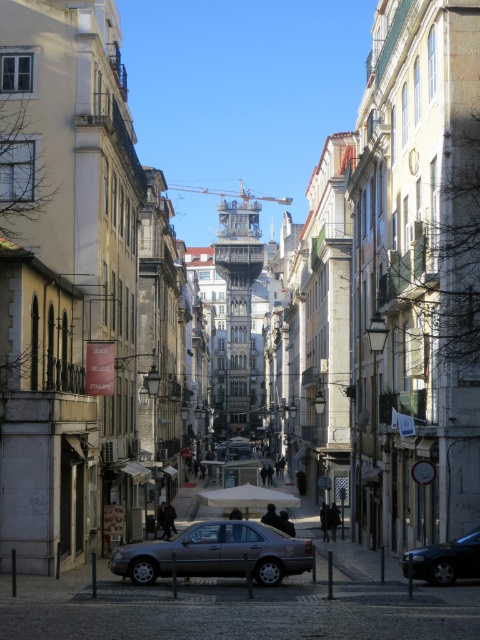
You are a delivery driver in Lisbon and need to park your metallic gray sedan at center. The parking spot is marked by a point at coordinates point (216,554). Can you safely park your car in this spot?

The point (216,554) indicates the location of the metallic gray sedan at center, so yes, you can safely park your metallic gray sedan at center in this spot.